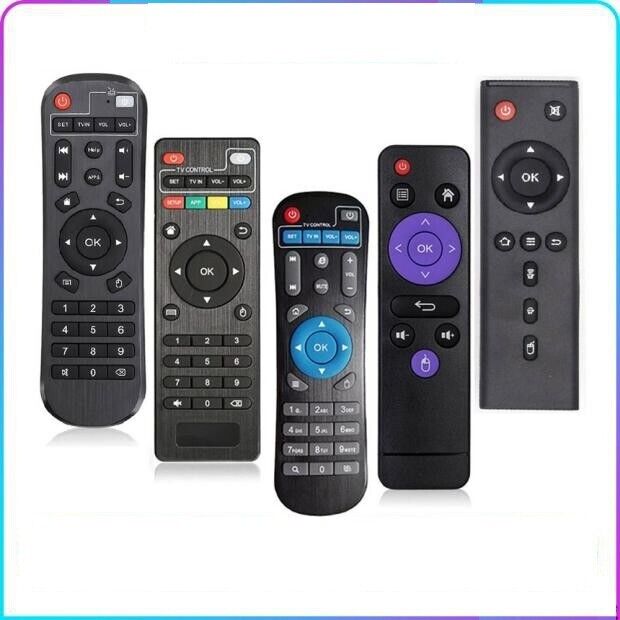
The image size is (620, 620). Find the location of `remote controls`. remote controls is located at coordinates (71, 306), (352, 381), (434, 329), (521, 338).